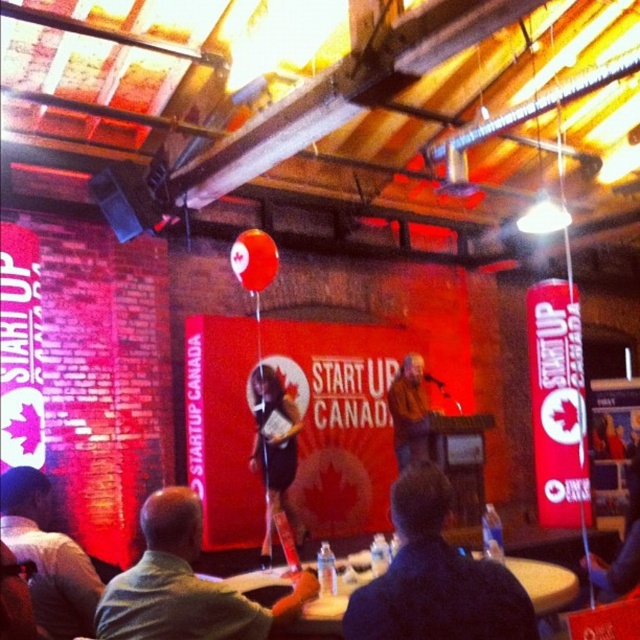
You are attending a presentation at the event space and notice a brown leather jacket at center. If you want to retrieve it without leaving your seat, can you reach it from where you are sitting?

The brown leather jacket at center is 5.24 meters away from the viewer, so you cannot reach it from your seat without moving.